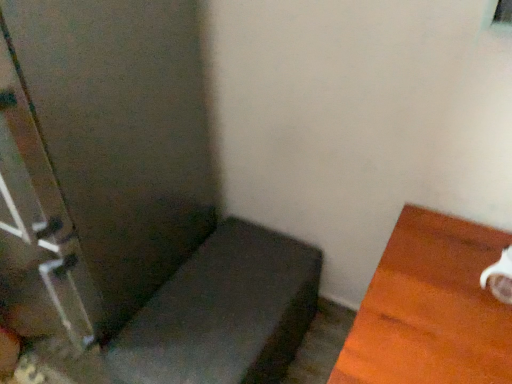
Question: Should I look upward or downward to see clear glass screen door at left?

Choices:
 (A) down
 (B) up

Answer: (B)

Question: Can you see matte gray cushion at lower left, which is counted as the 1th furniture, starting from the left, touching clear glass screen door at left?

Choices:
 (A) yes
 (B) no

Answer: (B)

Question: Is matte gray cushion at lower left, which is counted as the 1th furniture, starting from the left, bigger than clear glass screen door at left?

Choices:
 (A) yes
 (B) no

Answer: (B)

Question: From a real-world perspective, does matte gray cushion at lower left, positioned as the 2th furniture in right-to-left order, sit lower than clear glass screen door at left?

Choices:
 (A) no
 (B) yes

Answer: (B)

Question: Can we say matte gray cushion at lower left, which is counted as the 1th furniture, starting from the left, lies outside clear glass screen door at left?

Choices:
 (A) no
 (B) yes

Answer: (B)

Question: Is matte gray cushion at lower left, which is counted as the 1th furniture, starting from the left, smaller than clear glass screen door at left?

Choices:
 (A) no
 (B) yes

Answer: (B)

Question: Is matte gray cushion at lower left, which is counted as the 1th furniture, starting from the left, behind clear glass screen door at left?

Choices:
 (A) yes
 (B) no

Answer: (A)

Question: Is matte gray cushion at lower left, positioned as the 2th furniture in right-to-left order, turned away from white glossy mug at right, which is the 2th furniture from left to right?

Choices:
 (A) no
 (B) yes

Answer: (A)

Question: Does matte gray cushion at lower left, which is counted as the 1th furniture, starting from the left, have a smaller size compared to white glossy mug at right, which is the first furniture from right to left?

Choices:
 (A) no
 (B) yes

Answer: (B)

Question: Is matte gray cushion at lower left, which is counted as the 1th furniture, starting from the left, beside white glossy mug at right, which is the 2th furniture from left to right?

Choices:
 (A) yes
 (B) no

Answer: (B)

Question: From a real-world perspective, is matte gray cushion at lower left, which is counted as the 1th furniture, starting from the left, on top of white glossy mug at right, which is the 2th furniture from left to right?

Choices:
 (A) yes
 (B) no

Answer: (B)

Question: Is there a large distance between matte gray cushion at lower left, positioned as the 2th furniture in right-to-left order, and white glossy mug at right, which is the first furniture from right to left?

Choices:
 (A) no
 (B) yes

Answer: (A)

Question: Is matte gray cushion at lower left, positioned as the 2th furniture in right-to-left order, at the right side of white glossy mug at right, which is the first furniture from right to left?

Choices:
 (A) no
 (B) yes

Answer: (A)

Question: From a real-world perspective, is clear glass screen door at left positioned under matte gray cushion at lower left, positioned as the 2th furniture in right-to-left order, based on gravity?

Choices:
 (A) no
 (B) yes

Answer: (A)